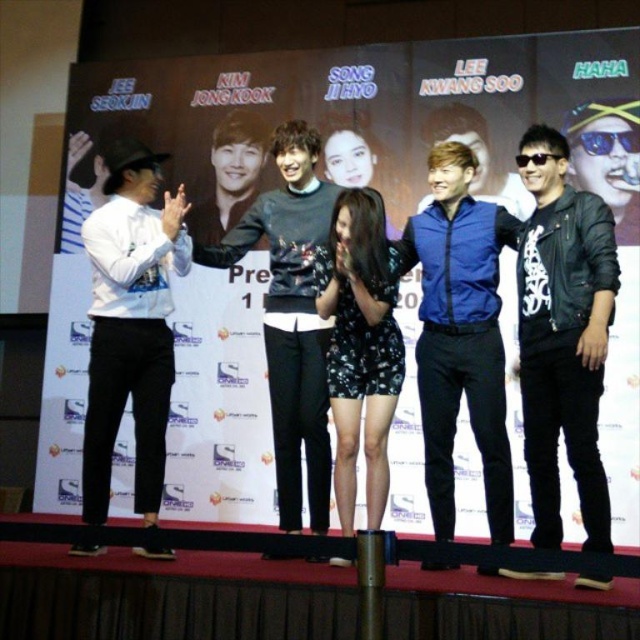
Can you confirm if white matte shirt at left is shorter than dark gray sweater at center?

Yes, white matte shirt at left is shorter than dark gray sweater at center.

Is white matte shirt at left to the right of dark gray sweater at center from the viewer's perspective?

In fact, white matte shirt at left is to the left of dark gray sweater at center.

This screenshot has height=640, width=640. What do you see at coordinates (131, 324) in the screenshot? I see `white matte shirt at left` at bounding box center [131, 324].

Locate an element on the screen. white matte shirt at left is located at coordinates (x=131, y=324).

Between black leather jacket at right and white matte shirt at left, which one appears on the left side from the viewer's perspective?

From the viewer's perspective, white matte shirt at left appears more on the left side.

From the picture: Which is more to the right, black leather jacket at right or white matte shirt at left?

Positioned to the right is black leather jacket at right.

Find the location of a particular element. The width and height of the screenshot is (640, 640). black leather jacket at right is located at coordinates (563, 337).

The width and height of the screenshot is (640, 640). I want to click on black leather jacket at right, so click(563, 337).

Who is shorter, black leather jacket at right or dark gray sweater at center?

A: black leather jacket at right

Who is positioned more to the right, black leather jacket at right or dark gray sweater at center?

black leather jacket at right is more to the right.

Identify the location of black leather jacket at right. The image size is (640, 640). (563, 337).

At what (x,y) coordinates should I click in order to perform the action: click on black leather jacket at right. Please return your answer as a coordinate pair (x, y). This screenshot has height=640, width=640. Looking at the image, I should click on (563, 337).